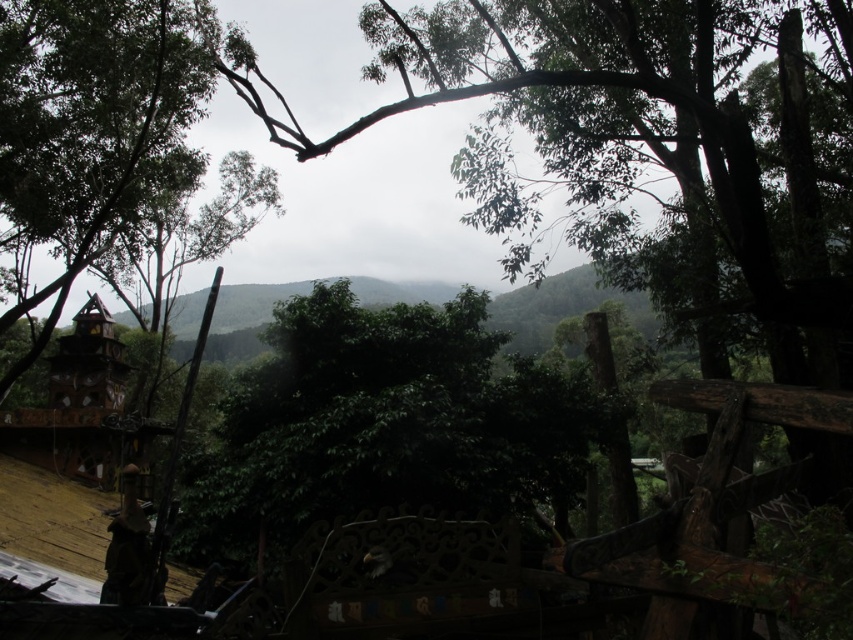
You are standing on the wooden structure and looking out. Which tree, the green leafy tree at center or the green matte tree at left, is positioned to the east?

The green leafy tree at center is to the right of green matte tree at left. Since you are facing the scene from the wooden structure, right would correspond to east. Therefore, the green leafy tree at center is positioned to the east.

You are standing on the wooden deck and looking at the green leafy tree at center and the green matte tree at left. Which tree is shorter?

The green leafy tree at center is shorter than the green matte tree at left.